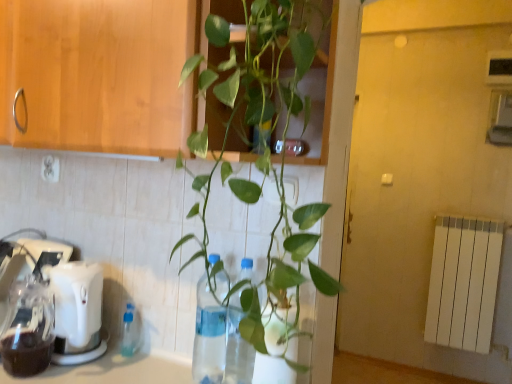
Question: Is transparent plastic bottle at center facing towards white plastic mixer at lower left?

Choices:
 (A) yes
 (B) no

Answer: (B)

Question: Is transparent plastic bottle at center facing away from white plastic mixer at lower left?

Choices:
 (A) yes
 (B) no

Answer: (B)

Question: From a real-world perspective, is transparent plastic bottle at center physically above white plastic mixer at lower left?

Choices:
 (A) yes
 (B) no

Answer: (A)

Question: Is transparent plastic bottle at center not close to white plastic mixer at lower left?

Choices:
 (A) no
 (B) yes

Answer: (A)

Question: Can you confirm if transparent plastic bottle at center is smaller than white plastic mixer at lower left?

Choices:
 (A) yes
 (B) no

Answer: (A)

Question: Considering the relative positions of transparent plastic bottle at center and white plastic mixer at lower left in the image provided, is transparent plastic bottle at center to the right of white plastic mixer at lower left from the viewer's perspective?

Choices:
 (A) yes
 (B) no

Answer: (A)

Question: Can you confirm if white plastic mixer at lower left is positioned to the left of white plastic electric outlet at upper left?

Choices:
 (A) yes
 (B) no

Answer: (A)

Question: From a real-world perspective, is white plastic mixer at lower left below white plastic electric outlet at upper left?

Choices:
 (A) yes
 (B) no

Answer: (A)

Question: Is white plastic mixer at lower left behind white plastic electric outlet at upper left?

Choices:
 (A) yes
 (B) no

Answer: (B)

Question: From the image's perspective, is white plastic mixer at lower left under white plastic electric outlet at upper left?

Choices:
 (A) yes
 (B) no

Answer: (A)

Question: Could you tell me if white plastic mixer at lower left is facing white plastic electric outlet at upper left?

Choices:
 (A) yes
 (B) no

Answer: (B)

Question: Is white plastic mixer at lower left bigger than white plastic electric outlet at upper left?

Choices:
 (A) no
 (B) yes

Answer: (B)

Question: From the image's perspective, does white plastic mixer at lower left appear higher than transparent plastic bottle at center?

Choices:
 (A) no
 (B) yes

Answer: (B)